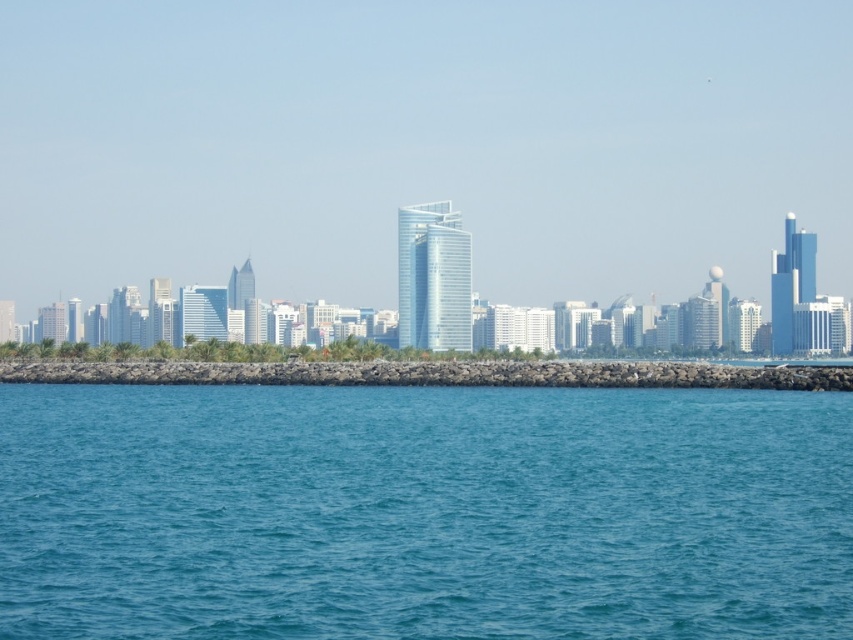
You are a photographer trying to capture the city skyline. You notice the blue water at center and the rocky barrier at center in your shot. Which of these two objects appears narrower in your photo?

The blue water at center appears narrower because it is thinner than the rocky barrier at center according to the description.

You are standing at the edge of the water in the cityscape image. You notice two points marked in the scene. The first point is at coordinates point [775,621] and the second is at point [273,365]. Which of these two points is closer to you, the observer?

Point [775,621] is in front of point [273,365], so it is closer to you.

You are a drone operator trying to capture the city skyline. You need to hover your drone at point (422, 512) to get the best shot. According to the scene description, what will the drone be hovering over?

The blue water at center is located at point (422, 512), so the drone will be hovering over the blue water at center.